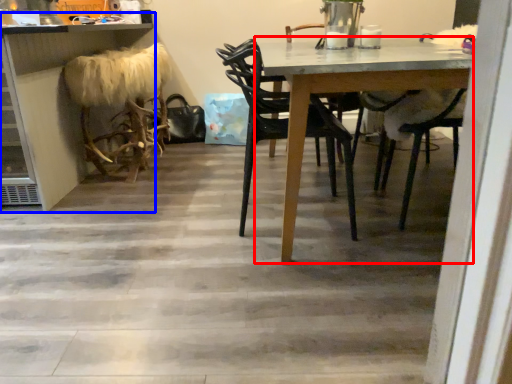
Question: Among these objects, which one is farthest to the camera, table (highlighted by a red box) or counter (highlighted by a blue box)?

Choices:
 (A) table
 (B) counter

Answer: (B)